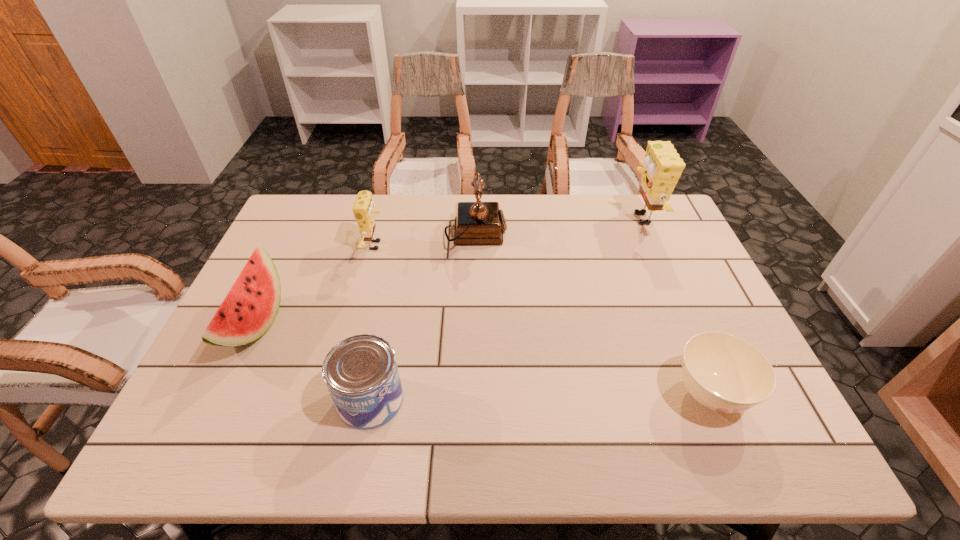
Find the location of a particular element. sugar bowl at the right edge is located at coordinates (724, 373).

This screenshot has width=960, height=540. In order to click on object that is at the far right corner in this screenshot , I will do `click(662, 167)`.

Identify the location of object present at the near right corner. Image resolution: width=960 pixels, height=540 pixels. (724, 373).

Image resolution: width=960 pixels, height=540 pixels. What are the coordinates of `free spot at the far edge of the desktop` in the screenshot? It's located at (384, 220).

The width and height of the screenshot is (960, 540). I want to click on free space at the near edge, so click(677, 425).

Where is `vacant region at the left edge of the desktop`? The height and width of the screenshot is (540, 960). vacant region at the left edge of the desktop is located at coordinates (300, 261).

Locate an element on the screen. free region at the right edge of the desktop is located at coordinates (638, 245).

Locate an element on the screen. The image size is (960, 540). empty space between the tallest object and the can is located at coordinates (505, 309).

At what (x,y) coordinates should I click in order to perform the action: click on free space between the watermelon and the shorter sponge. Please return your answer as a coordinate pair (x, y). The width and height of the screenshot is (960, 540). Looking at the image, I should click on (315, 285).

Find the location of `free area in between the telephone and the right sponge`. free area in between the telephone and the right sponge is located at coordinates (558, 226).